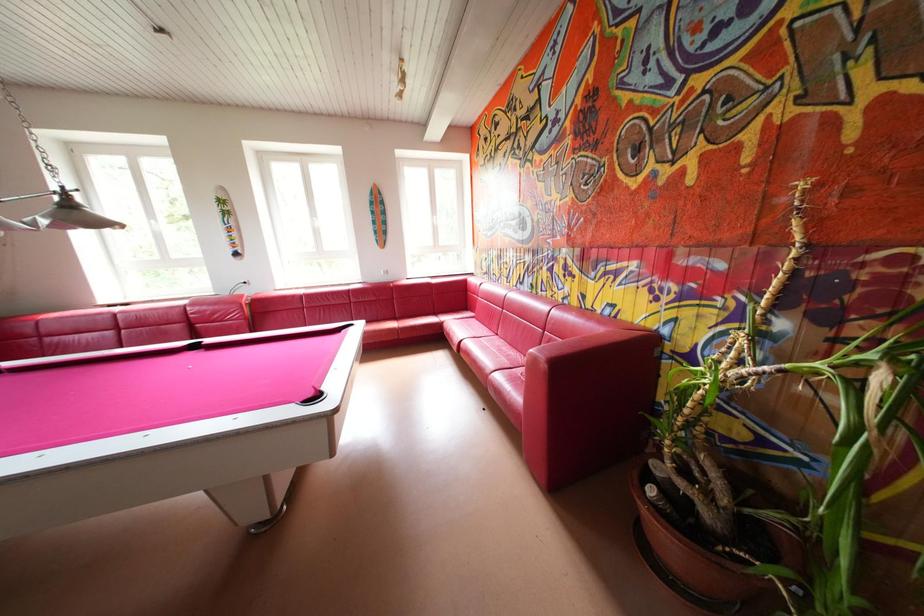
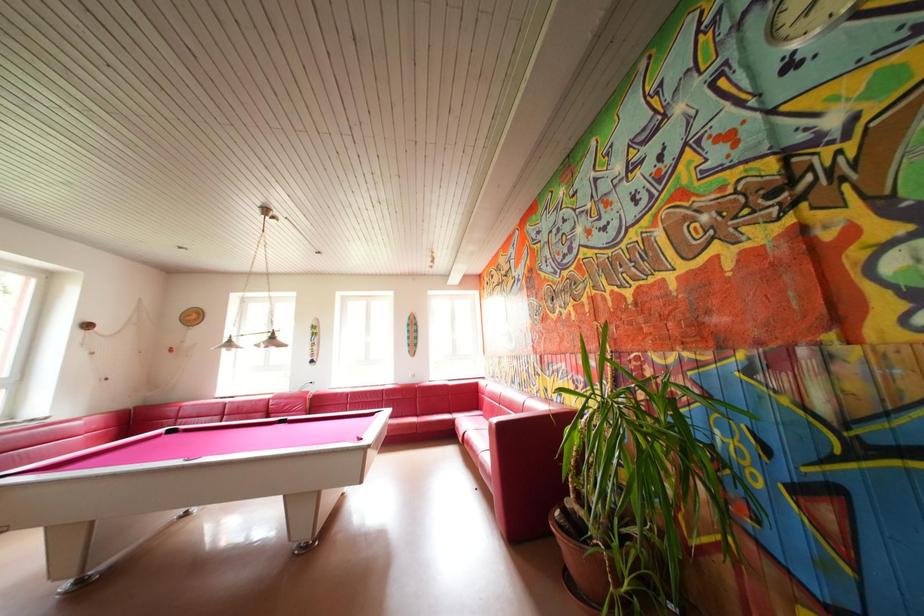
From the picture: Which direction would the cameraman need to move to produce the second image?

The movement direction of the cameraman is right, backward.